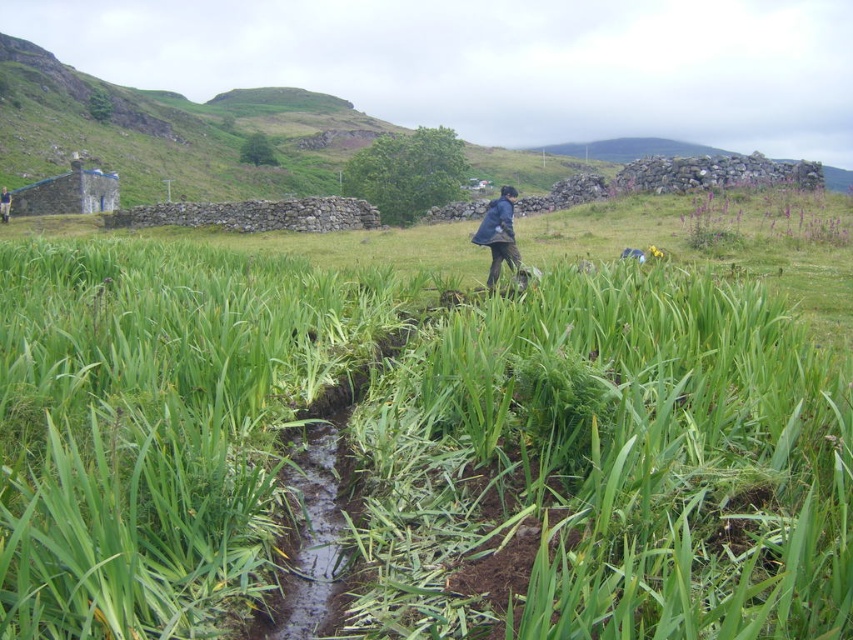
You are standing at the edge of the field and see the green grassy at center and the blue fabric jacket at center. Which object is nearer to you?

The green grassy at center is closer to the viewer than the blue fabric jacket at center, so the green grassy at center is nearer to you.

You are a hiker who has just arrived at the rural landscape scene. You see the green grassy at center and the blue fabric jacket at center. Which object is positioned to the left of the other?

The green grassy at center is to the left of the blue fabric jacket at center.